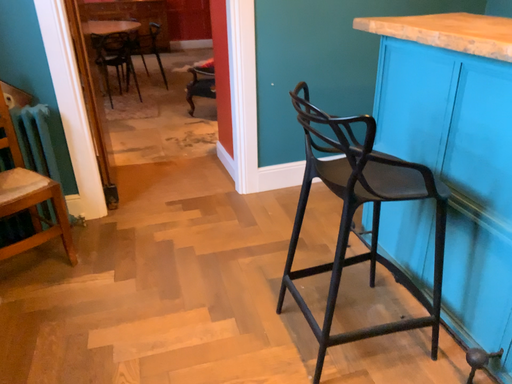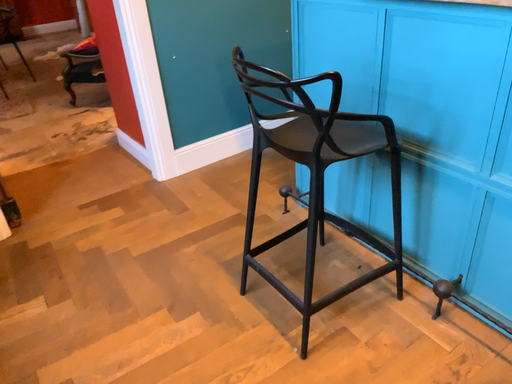
Question: How did the camera likely rotate when shooting the video?

Choices:
 (A) rotated right
 (B) rotated left

Answer: (A)